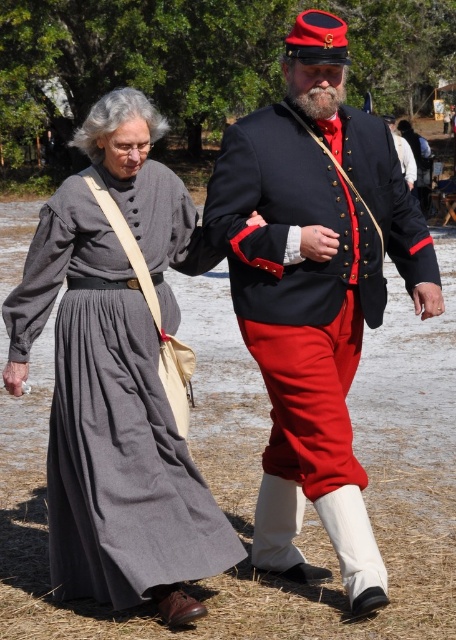
Which is in front, point (229, 234) or point (260, 224)?

Point (229, 234) is in front.

Can you confirm if shiny black coat at center is positioned above matte black glove at upper center?

Actually, shiny black coat at center is below matte black glove at upper center.

Is point (233, 269) more distant than point (248, 220)?

Yes, point (233, 269) is farther from viewer.

Locate an element on the screen. The image size is (456, 640). shiny black coat at center is located at coordinates (314, 291).

Locate an element on the screen. The width and height of the screenshot is (456, 640). gray cotton dress at left is located at coordinates (109, 420).

Is point (145, 593) closer to camera compared to point (253, 221)?

That is True.

Is point (128, 444) positioned in front of point (259, 216)?

Yes, it is in front of point (259, 216).

Locate an element on the screen. This screenshot has width=456, height=640. gray cotton dress at left is located at coordinates tap(109, 420).

Between gray cotton dress at left and smooth skin hand at lower left, which one is positioned higher?

gray cotton dress at left

Who is lower down, gray cotton dress at left or smooth skin hand at lower left?

Positioned lower is smooth skin hand at lower left.

Find the location of a particular element. The width and height of the screenshot is (456, 640). gray cotton dress at left is located at coordinates (109, 420).